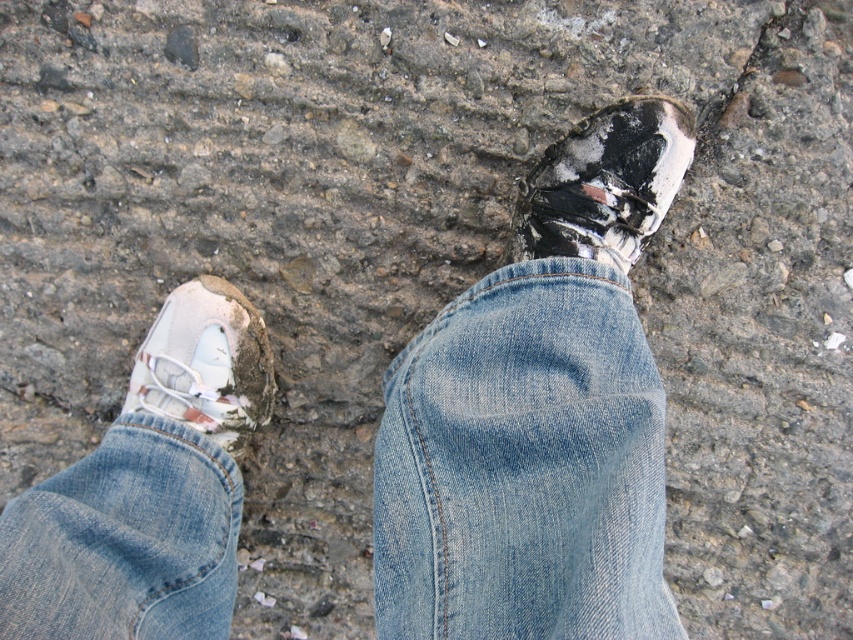
Is denim at center behind white matte shoe at lower left?

No, denim at center is closer to the viewer.

Between denim at center and white matte shoe at lower left, which one has less height?

Standing shorter between the two is white matte shoe at lower left.

Is point (640, 634) closer to viewer compared to point (193, 324)?

Yes, point (640, 634) is in front of point (193, 324).

Identify the location of denim at center. The width and height of the screenshot is (853, 640). (524, 465).

The width and height of the screenshot is (853, 640). Describe the element at coordinates (523, 465) in the screenshot. I see `light blue denim jeans at center` at that location.

Is light blue denim jeans at center positioned before white matte shoe at lower left?

Yes, light blue denim jeans at center is in front of white matte shoe at lower left.

Who is more distant from viewer, (415,358) or (236,436)?

The point (236,436) is behind.

Identify the location of light blue denim jeans at center. (523, 465).

Who is more distant from viewer, [534,474] or [207,484]?

Point [207,484]

Can you confirm if light blue denim jeans at center is bigger than light blue denim jeans at lower left?

Correct, light blue denim jeans at center is larger in size than light blue denim jeans at lower left.

Between point (656, 397) and point (119, 614), which one is positioned in front?

Point (119, 614) is more forward.

I want to click on light blue denim jeans at center, so click(x=523, y=465).